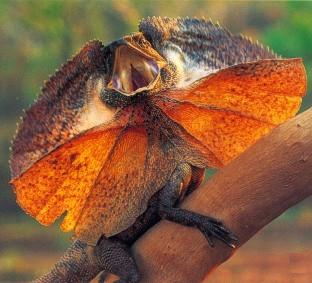
You are a GUI agent. You are given a task and a screenshot of the screen. Output one action in this format:
    pyautogui.click(x=<x>, y=<y>)
    Task: Click on the scales
    The width and height of the screenshot is (312, 283).
    Given the screenshot: What is the action you would take?
    pyautogui.click(x=92, y=274), pyautogui.click(x=111, y=262), pyautogui.click(x=170, y=189), pyautogui.click(x=121, y=96), pyautogui.click(x=170, y=78)